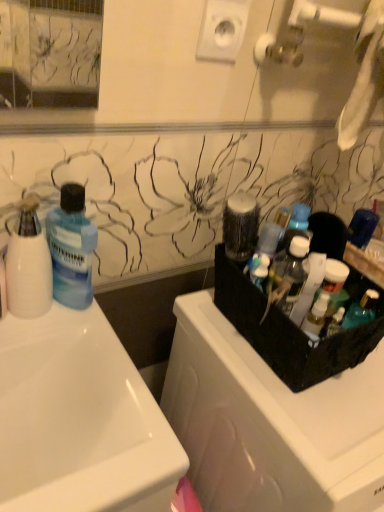
Question: Is translucent plastic container at upper right facing away from translucent plastic bottles at right, placed as the 1th cleaning product when sorted from right to left?

Choices:
 (A) yes
 (B) no

Answer: (B)

Question: Is translucent plastic container at upper right to the right of translucent plastic bottles at right, which appears as the 2th cleaning product when viewed from the left, from the viewer's perspective?

Choices:
 (A) yes
 (B) no

Answer: (B)

Question: From a real-world perspective, does translucent plastic container at upper right stand above translucent plastic bottles at right, which appears as the 2th cleaning product when viewed from the left?

Choices:
 (A) yes
 (B) no

Answer: (A)

Question: Considering the relative sizes of translucent plastic container at upper right and translucent plastic bottles at right, placed as the 1th cleaning product when sorted from right to left, in the image provided, is translucent plastic container at upper right smaller than translucent plastic bottles at right, placed as the 1th cleaning product when sorted from right to left,?

Choices:
 (A) no
 (B) yes

Answer: (B)

Question: Is translucent plastic container at upper right to the left of translucent plastic bottles at right, placed as the 1th cleaning product when sorted from right to left, from the viewer's perspective?

Choices:
 (A) no
 (B) yes

Answer: (B)

Question: Is translucent plastic container at upper right in front of or behind black plastic dish washer at right in the image?

Choices:
 (A) behind
 (B) front

Answer: (A)

Question: Is point [x=284, y=239] closer or farther from the camera than point [x=273, y=463]?

Choices:
 (A) closer
 (B) farther

Answer: (B)

Question: In terms of width, does translucent plastic container at upper right look wider or thinner when compared to black plastic dish washer at right?

Choices:
 (A) thin
 (B) wide

Answer: (A)

Question: From a real-world perspective, is translucent plastic container at upper right physically located above or below black plastic dish washer at right?

Choices:
 (A) above
 (B) below

Answer: (A)

Question: Based on their sizes in the image, would you say white glossy sink at left is bigger or smaller than blue translucent liquid at left?

Choices:
 (A) big
 (B) small

Answer: (A)

Question: Looking at their shapes, would you say white glossy sink at left is wider or thinner than blue translucent liquid at left?

Choices:
 (A) thin
 (B) wide

Answer: (B)

Question: From a real-world perspective, is white glossy sink at left positioned above or below blue translucent liquid at left?

Choices:
 (A) below
 (B) above

Answer: (A)

Question: Is white glossy sink at left in front of or behind blue translucent liquid at left in the image?

Choices:
 (A) front
 (B) behind

Answer: (A)

Question: In terms of height, does white glossy sink at left look taller or shorter compared to translucent plastic bottles at right, which appears as the 2th cleaning product when viewed from the left?

Choices:
 (A) short
 (B) tall

Answer: (B)

Question: Based on their sizes in the image, would you say white glossy sink at left is bigger or smaller than translucent plastic bottles at right, which appears as the 2th cleaning product when viewed from the left?

Choices:
 (A) big
 (B) small

Answer: (A)